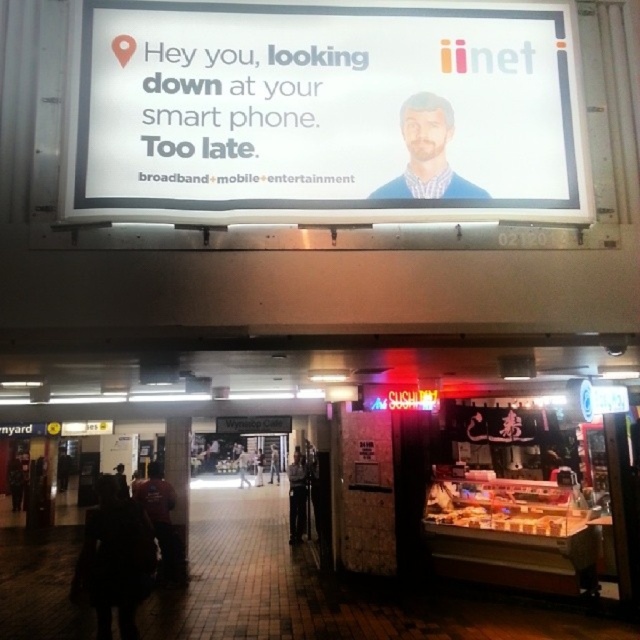
You are a customer in the mall looking for the sushi stall. You see dark clothing at lower left and dark blue sweater at center. Which object is closer to the sushi stall?

The dark clothing at lower left is closer to the sushi stall because it is to the left of the dark blue sweater at center, and the sushi stall is located below the advertisement in the food court area.

You are a customer in the mall and want to find the sushi stall. You see the dark clothing at lower left and the matte blue shirt at center. Which object is closer to the sushi stall?

The dark clothing at lower left is closer to the sushi stall because it is located below the matte blue shirt at center, which is further away from the stall.